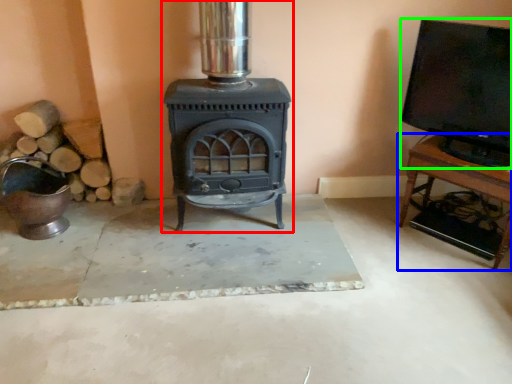
Question: Estimate the real-world distances between objects in this image. Which object is farther from wood burning stove (highlighted by a red box), furniture (highlighted by a blue box) or wide (highlighted by a green box)?

Choices:
 (A) furniture
 (B) wide

Answer: (A)